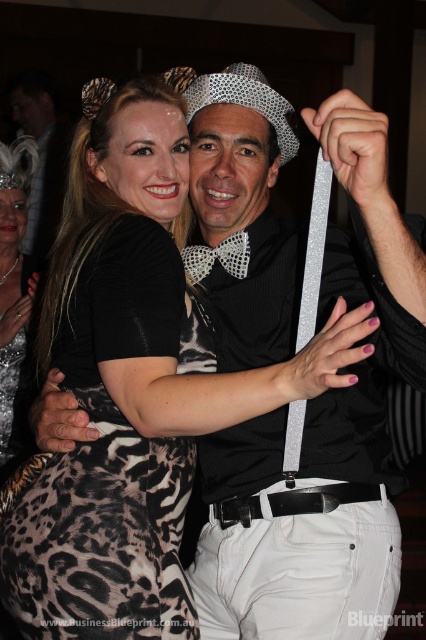
Who is positioned more to the left, matte black bow tie at center or black dotted bowtie at center?

matte black bow tie at center

Which of these two, matte black bow tie at center or black dotted bowtie at center, stands shorter?

black dotted bowtie at center is shorter.

The width and height of the screenshot is (426, 640). Identify the location of matte black bow tie at center. (40, 154).

Can you confirm if leopard print fabric dress at center is bigger than leopard print dress at center?

Incorrect, leopard print fabric dress at center is not larger than leopard print dress at center.

Who is more forward, (143, 252) or (13, 268)?

Point (143, 252) is in front.

Who is more distant from viewer, (42, 566) or (3, 276)?

Point (3, 276)

Find the location of `leopard print fabric dress at center`. leopard print fabric dress at center is located at coordinates (111, 465).

Is leopard print fabric dress at center above black dotted bowtie at center?

Actually, leopard print fabric dress at center is below black dotted bowtie at center.

Is leopard print fabric dress at center positioned at the back of black dotted bowtie at center?

No, leopard print fabric dress at center is in front of black dotted bowtie at center.

Is point (175, 602) more distant than point (210, 253)?

No.

Locate an element on the screen. The image size is (426, 640). leopard print fabric dress at center is located at coordinates (111, 465).